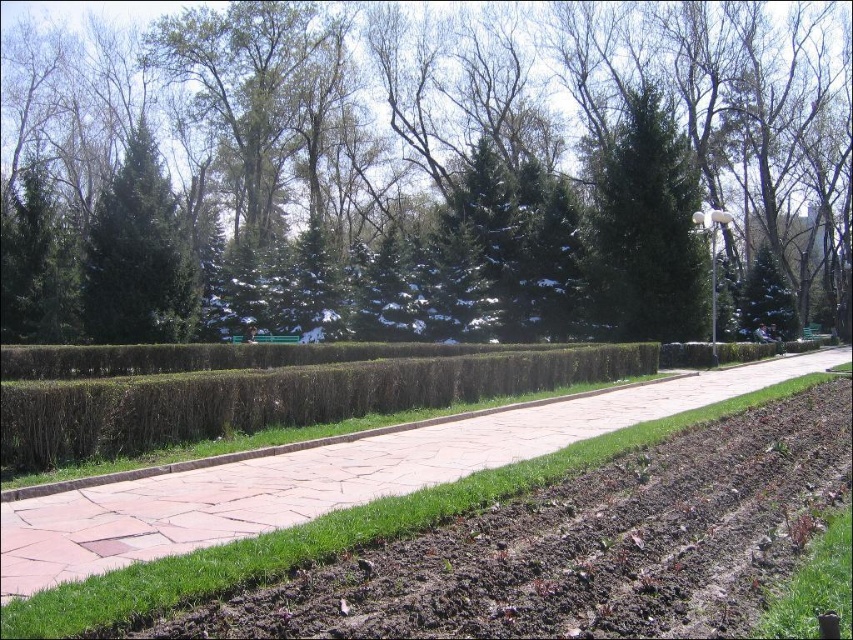
In the scene shown: You are standing at the entrance of the park and notice the green textured hedge at center. Based on its position, can you determine if it is closer to the front or the back of the park?

The green textured hedge at center is located at point (426, 172), which places it closer to the front of the park since it has a lower y coordinate.